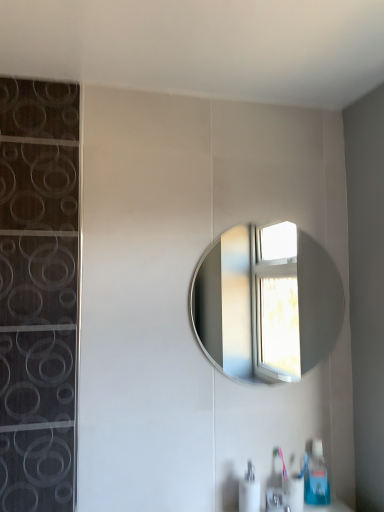
Question: Is point (281, 498) closer or farther from the camera than point (244, 252)?

Choices:
 (A) closer
 (B) farther

Answer: (A)

Question: Considering the relative positions of satin nickel faucet at lower center and silver metallic mirror at center in the image provided, is satin nickel faucet at lower center to the left or to the right of silver metallic mirror at center?

Choices:
 (A) right
 (B) left

Answer: (A)

Question: Considering the real-world distances, which object is closest to the white glossy soap dispenser at lower center, the 2th soap dispenser when ordered from back to front?

Choices:
 (A) satin nickel faucet at lower center
 (B) blue plastic soap dispenser at lower right, the 2th soap dispenser viewed from the left
 (C) silver metallic mirror at center

Answer: (A)

Question: Which of these objects is positioned farthest from the silver metallic mirror at center?

Choices:
 (A) white glossy soap dispenser at lower center, which is the first soap dispenser in left-to-right order
 (B) satin nickel faucet at lower center
 (C) blue plastic soap dispenser at lower right, the 2th soap dispenser when ordered from front to back

Answer: (B)